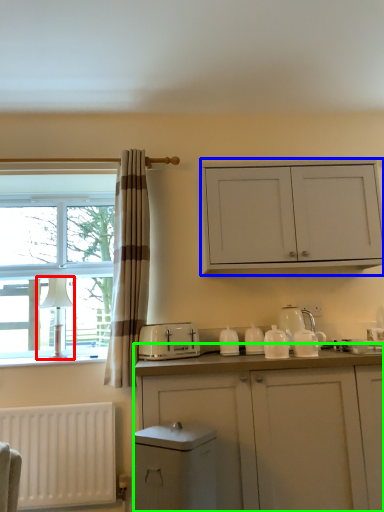
Question: Which object is positioned closest to lamp (highlighted by a red box)? Select from cabinetry (highlighted by a blue box) and cabinetry (highlighted by a green box).

Choices:
 (A) cabinetry
 (B) cabinetry

Answer: (A)